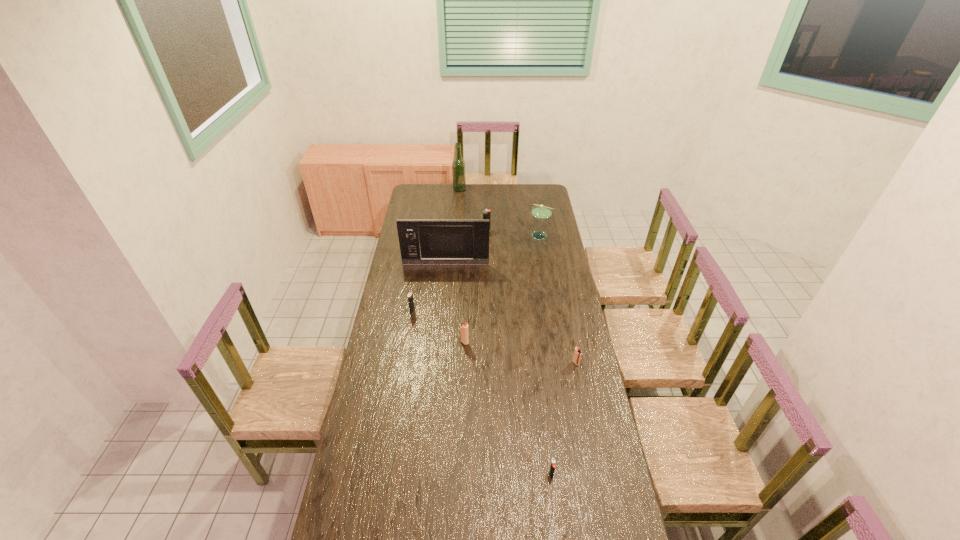
Where is `the farthest object`? The height and width of the screenshot is (540, 960). the farthest object is located at coordinates (458, 164).

I want to click on liquor, so coord(458,164).

Locate an element on the screen. This screenshot has height=540, width=960. dark microwave oven is located at coordinates (422, 241).

Find the location of a particular element. Image resolution: width=960 pixels, height=540 pixels. microwave oven is located at coordinates (422, 241).

Find the location of `green martini`. green martini is located at coordinates (540, 211).

The width and height of the screenshot is (960, 540). I want to click on the sixth shortest object, so click(x=540, y=211).

The height and width of the screenshot is (540, 960). In order to click on the second black igniter from right to left in this screenshot , I will do `click(486, 213)`.

Find the location of a particular element. This screenshot has width=960, height=540. the farthest igniter is located at coordinates (486, 213).

Find the location of a particular element. the second smallest black igniter is located at coordinates tap(410, 295).

Find the location of a particular element. the leftmost black igniter is located at coordinates (410, 295).